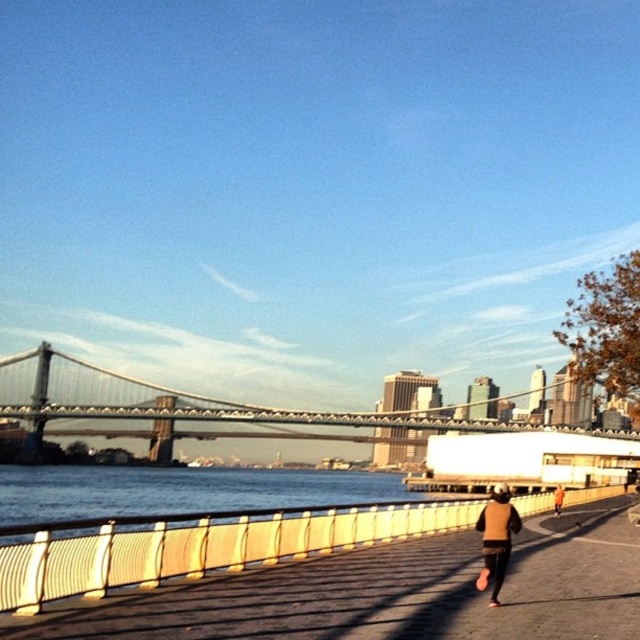
You are a photographer trying to capture a wide shot of the waterfront scene. You notice the metallic gray suspension bridge at center and the orange fabric jacket at lower right. Which object would require a wider lens to ensure it fits entirely within the frame?

The metallic gray suspension bridge at center has a larger width than the orange fabric jacket at lower right, so it would require a wider lens to fit entirely within the frame.

You are a photographer trying to capture the metallic gray suspension bridge at center and the orange fabric jacket at lower right in the same frame. Based on their positions, which object would appear larger in your photo?

The metallic gray suspension bridge at center would appear larger in the photo because it is taller than the orange fabric jacket at lower right.